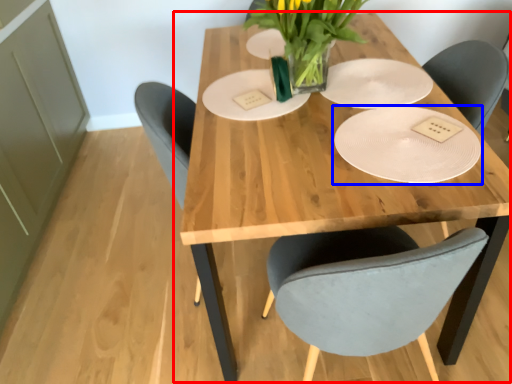
Question: Which object is further to the camera taking this photo, table (highlighted by a red box) or plate (highlighted by a blue box)?

Choices:
 (A) table
 (B) plate

Answer: (B)